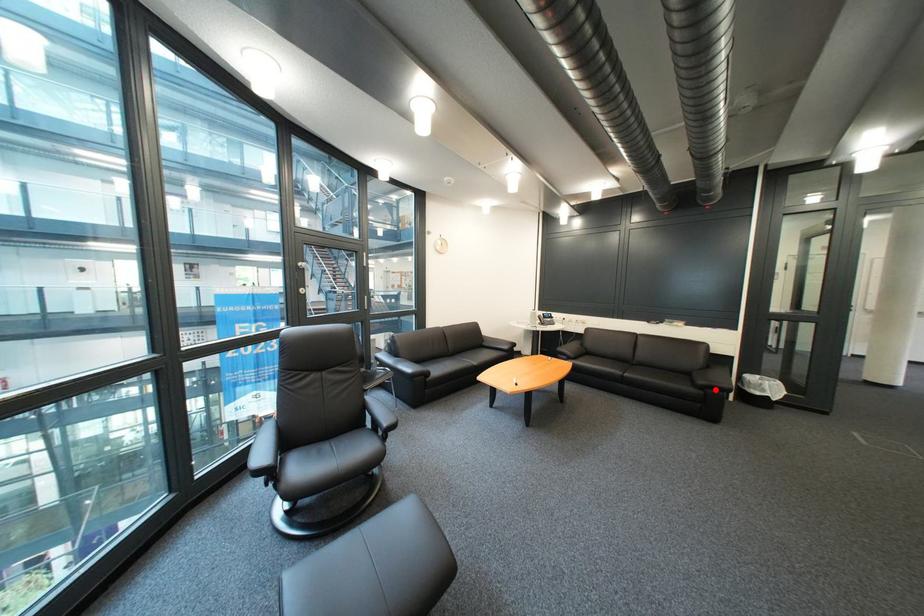
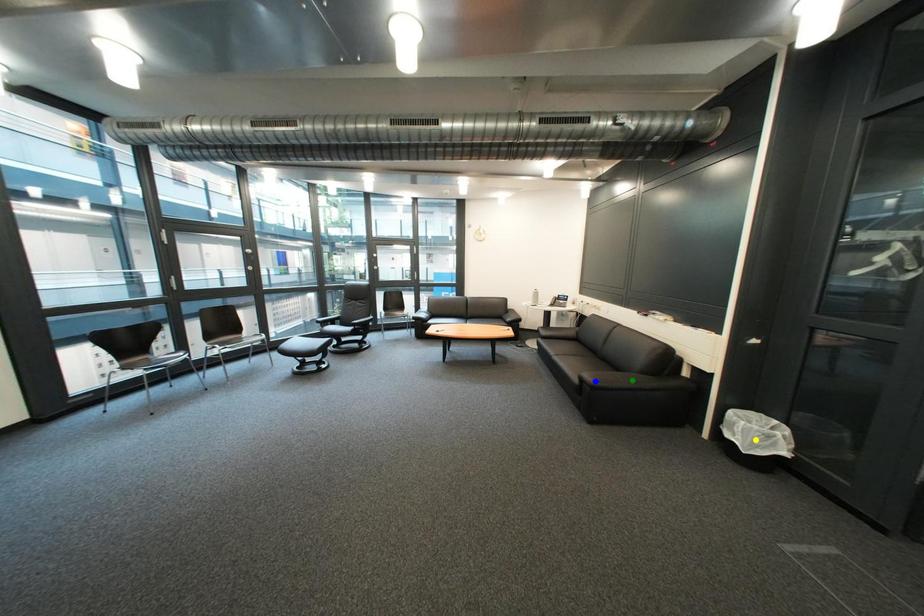
Question: I am providing you with two images of the same scene from different viewpoints. A red point is marked on the first image. You are given multiple points on the second image. Which point in image 2 is actually the same real-world point as the red point in image 1?

Choices:
 (A) yellow point
 (B) blue point
 (C) green point

Answer: (B)